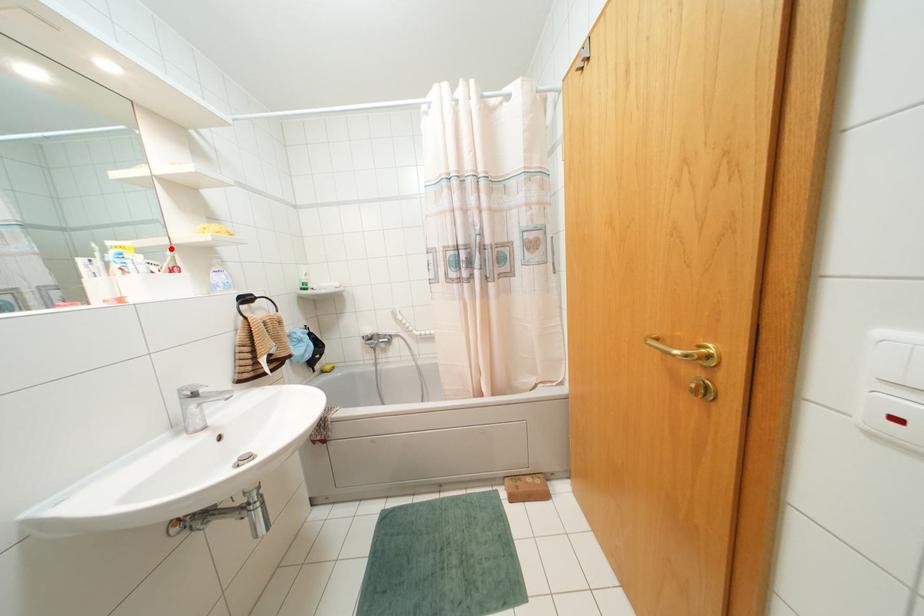
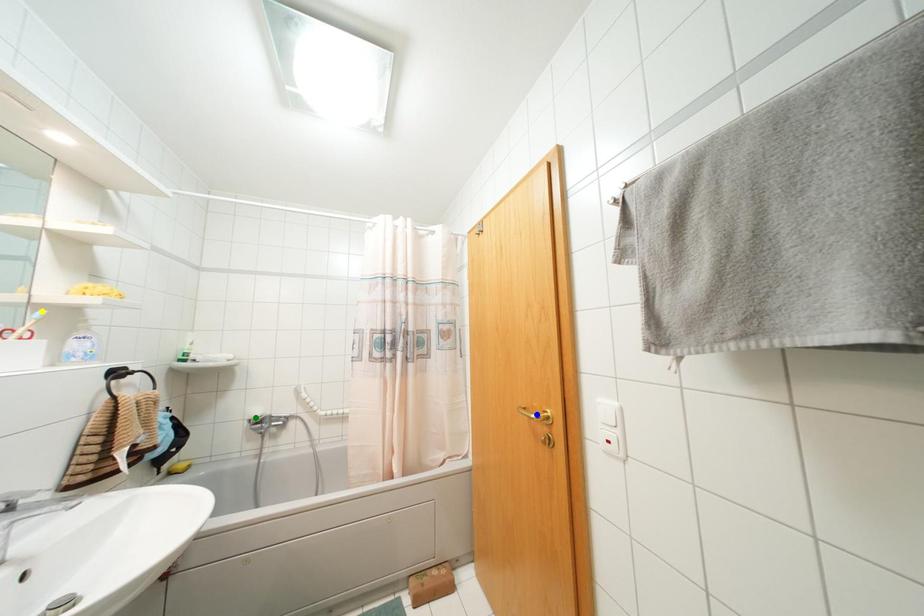
Question: I am providing you with two images of the same scene from different viewpoints. A red point is marked on the first image. You are given multiple points on the second image. Which point in image 2 is actually the same real-world point as the red point in image 1?

Choices:
 (A) blue point
 (B) yellow point
 (C) green point

Answer: (B)